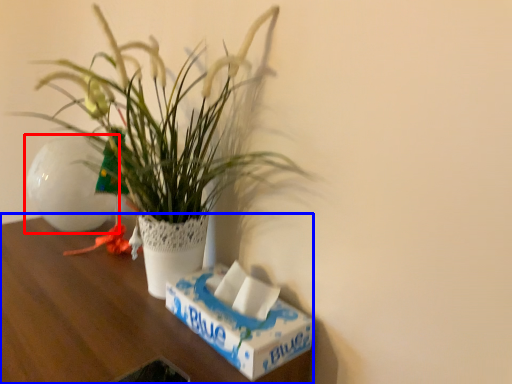
Question: Which of the following is the closest to the observer, flowerpot (highlighted by a red box) or table (highlighted by a blue box)?

Choices:
 (A) flowerpot
 (B) table

Answer: (B)